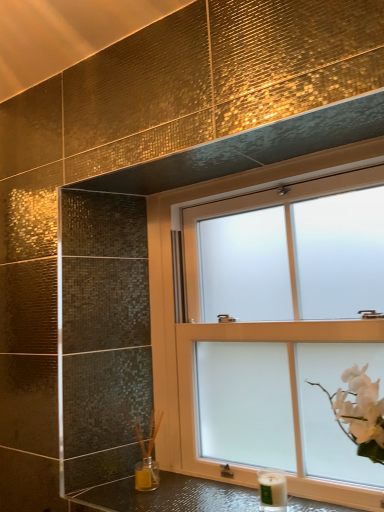
The height and width of the screenshot is (512, 384). I want to click on frosted glass window at upper center, so coord(172,280).

Is the depth of white matte candle at lower right less than that of frosted glass window at upper center?

No.

Which of these two, white matte candle at lower right or frosted glass window at upper center, is bigger?

frosted glass window at upper center.

This screenshot has height=512, width=384. Identify the location of window lying on the right of white matte candle at lower right. (172, 280).

Based on the photo, in the image, is white matte candle at lower right on the left side or the right side of frosted glass window at upper center?

white matte candle at lower right is positioned on frosted glass window at upper center's left side.

From a real-world perspective, between white matte candle at lower right and shiny metallic counter top at lower center, who is vertically lower?

In real-world perspective, shiny metallic counter top at lower center is lower.

Is white matte candle at lower right next to shiny metallic counter top at lower center and touching it?

white matte candle at lower right and shiny metallic counter top at lower center are not in contact.

Which of these two, white matte candle at lower right or shiny metallic counter top at lower center, is bigger?

Bigger between the two is shiny metallic counter top at lower center.

Does white matte candle at lower right have a lesser width compared to shiny metallic counter top at lower center?

Indeed, white matte candle at lower right has a lesser width compared to shiny metallic counter top at lower center.

What's the angular difference between shiny metallic counter top at lower center and frosted glass window at upper center's facing directions?

There is a 0.296-degree angle between the facing directions of shiny metallic counter top at lower center and frosted glass window at upper center.

How distant is shiny metallic counter top at lower center from frosted glass window at upper center?

shiny metallic counter top at lower center is 13.92 inches from frosted glass window at upper center.

From the image's perspective, is shiny metallic counter top at lower center under frosted glass window at upper center?

Correct, shiny metallic counter top at lower center appears lower than frosted glass window at upper center in the image.

Would you say shiny metallic counter top at lower center is outside frosted glass window at upper center?

Yes.

Considering the positions of objects frosted glass window at upper center and shiny metallic counter top at lower center in the image provided, who is more to the right, frosted glass window at upper center or shiny metallic counter top at lower center?

frosted glass window at upper center is more to the right.

Where is `window above the shiny metallic counter top at lower center (from the image's perspective)`? The image size is (384, 512). window above the shiny metallic counter top at lower center (from the image's perspective) is located at coordinates (172, 280).

Is the depth of frosted glass window at upper center less than that of shiny metallic counter top at lower center?

No, it is not.

Between frosted glass window at upper center and shiny metallic counter top at lower center, which one has smaller size?

shiny metallic counter top at lower center.

Is shiny metallic counter top at lower center situated inside white matte candle at lower right or outside?

shiny metallic counter top at lower center exists outside the volume of white matte candle at lower right.

This screenshot has height=512, width=384. Find the location of `candle holder above the shiny metallic counter top at lower center (from the image's perspective)`. candle holder above the shiny metallic counter top at lower center (from the image's perspective) is located at coordinates (272, 490).

Based on their sizes in the image, would you say shiny metallic counter top at lower center is bigger or smaller than white matte candle at lower right?

Considering their sizes, shiny metallic counter top at lower center takes up more space than white matte candle at lower right.

Looking at their sizes, would you say shiny metallic counter top at lower center is wider or thinner than white matte candle at lower right?

Clearly, shiny metallic counter top at lower center has more width compared to white matte candle at lower right.

Can you tell me how much frosted glass window at upper center and white matte candle at lower right differ in facing direction?

0.415 degrees.

Are frosted glass window at upper center and white matte candle at lower right located far from each other?

No, frosted glass window at upper center is in close proximity to white matte candle at lower right.

Which point is more distant from viewer, (248, 188) or (260, 501)?

The point (248, 188) is more distant.

Is frosted glass window at upper center not inside white matte candle at lower right?

That's correct, frosted glass window at upper center is outside of white matte candle at lower right.

What are the coordinates of `window in front of the white matte candle at lower right` in the screenshot? It's located at (172, 280).

Identify the location of candle holder that is on the right side of shiny metallic counter top at lower center. Image resolution: width=384 pixels, height=512 pixels. (272, 490).

Based on their spatial positions, is shiny metallic counter top at lower center or white matte candle at lower right further from frosted glass window at upper center?

Among the two, white matte candle at lower right is located further to frosted glass window at upper center.

Which object lies nearer to the anchor point white matte candle at lower right, frosted glass window at upper center or shiny metallic counter top at lower center?

Based on the image, shiny metallic counter top at lower center appears to be nearer to white matte candle at lower right.

Estimate the real-world distances between objects in this image. Which object is closer to frosted glass window at upper center, white matte candle at lower right or shiny metallic counter top at lower center?

shiny metallic counter top at lower center is positioned closer to the anchor frosted glass window at upper center.

Looking at the image, which one is located further to white matte candle at lower right, shiny metallic counter top at lower center or frosted glass window at upper center?

Based on the image, frosted glass window at upper center appears to be further to white matte candle at lower right.

Estimate the real-world distances between objects in this image. Which object is closer to shiny metallic counter top at lower center, frosted glass window at upper center or white matte candle at lower right?

The object closer to shiny metallic counter top at lower center is white matte candle at lower right.

Estimate the real-world distances between objects in this image. Which object is closer to shiny metallic counter top at lower center, white matte candle at lower right or frosted glass window at upper center?

Among the two, white matte candle at lower right is located nearer to shiny metallic counter top at lower center.

You are a GUI agent. You are given a task and a screenshot of the screen. Output one action in this format:
    pyautogui.click(x=<x>, y=<y>)
    Task: Click on the candle holder between frosted glass window at upper center and shiny metallic counter top at lower center vertically
    This screenshot has width=384, height=512.
    Given the screenshot: What is the action you would take?
    pyautogui.click(x=272, y=490)